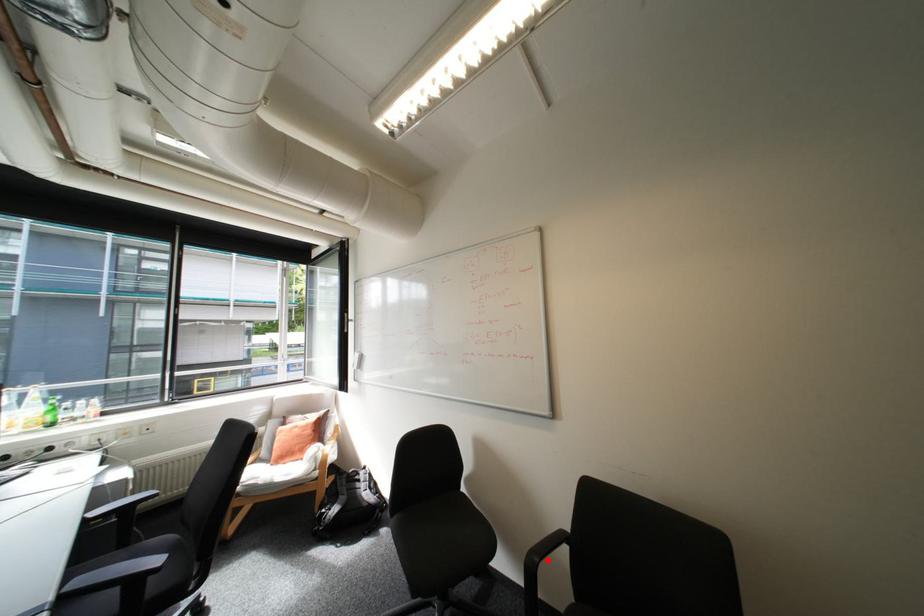
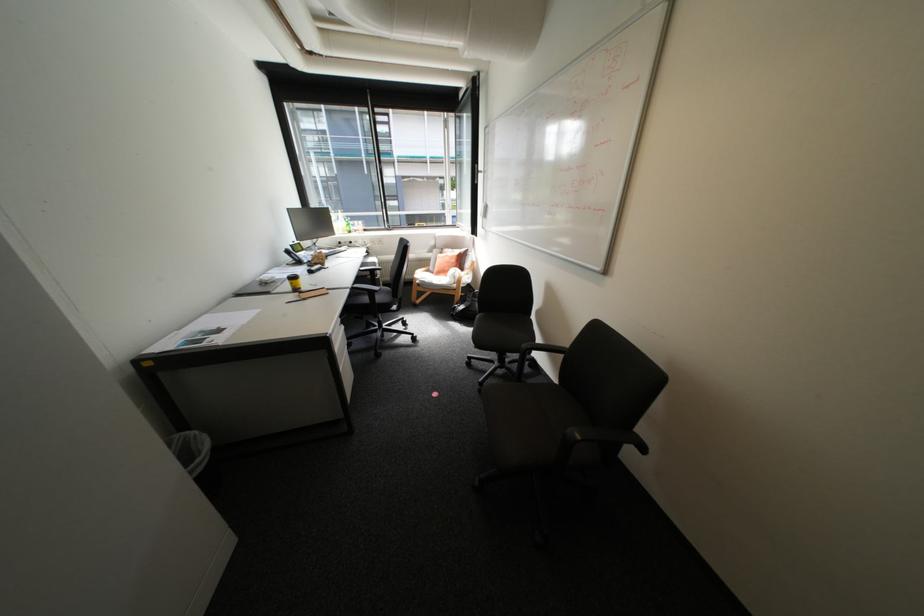
Find the pixel in the second image that matches the highlighted location in the first image.

(539, 347)